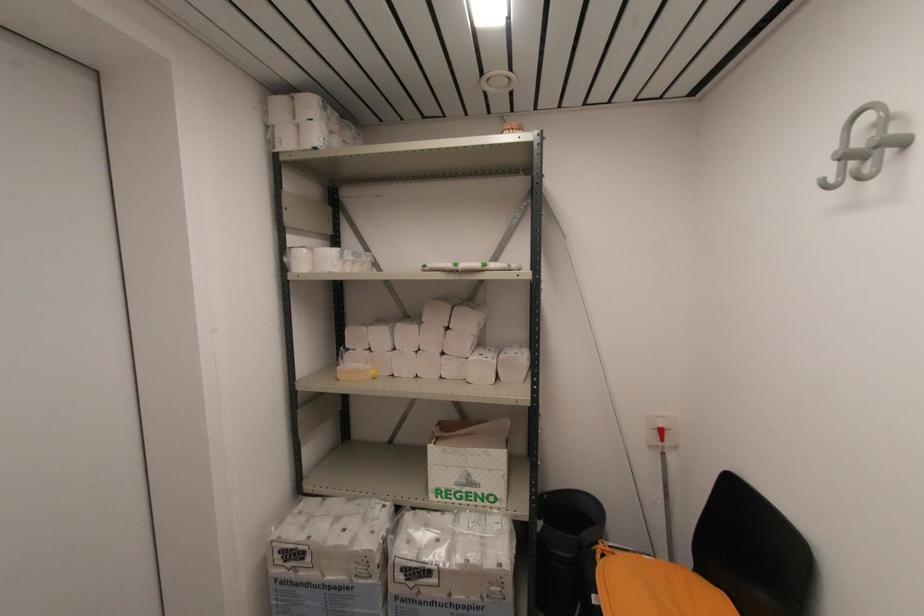
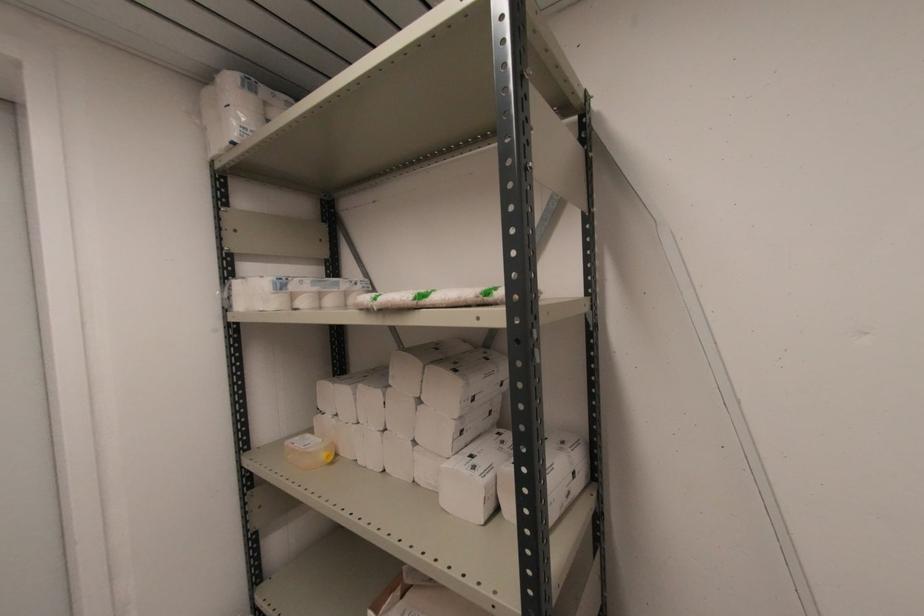
In the second image, find the point that corresponds to the point at 339,369 in the first image.

(289, 442)